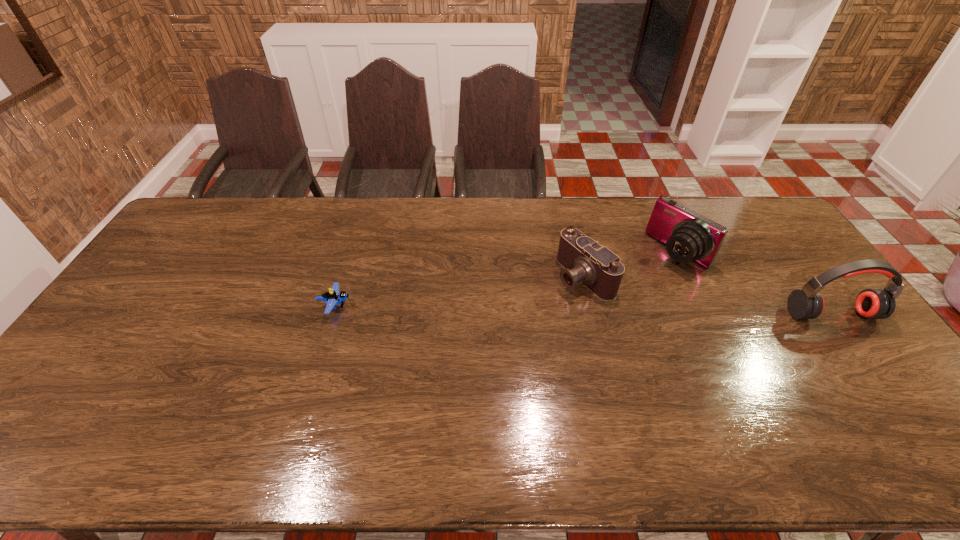
The width and height of the screenshot is (960, 540). I want to click on free space on the desktop that is between the leftmost object and the earphone and is positioned on the front-facing side of the second object from right to left, so click(x=601, y=310).

At what (x,y) coordinates should I click in order to perform the action: click on free space on the desktop that is between the Lego and the earphone and is positioned on the front-facing side of the second object from left to right. Please return your answer as a coordinate pair (x, y). The image size is (960, 540). Looking at the image, I should click on (518, 309).